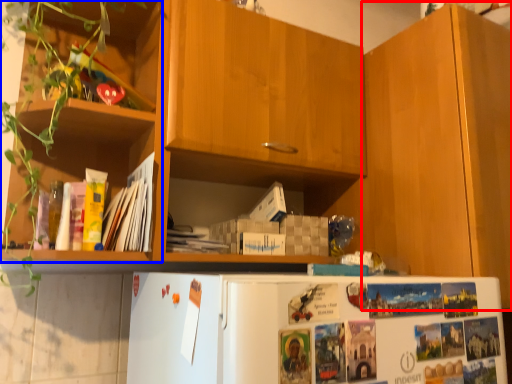
Question: Which point is closer to the camera, cabinetry (highlighted by a red box) or shelf (highlighted by a blue box)?

Choices:
 (A) cabinetry
 (B) shelf

Answer: (B)